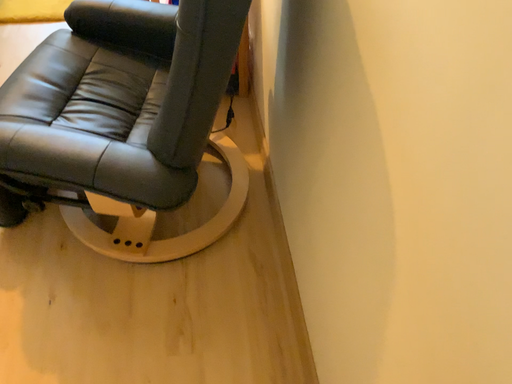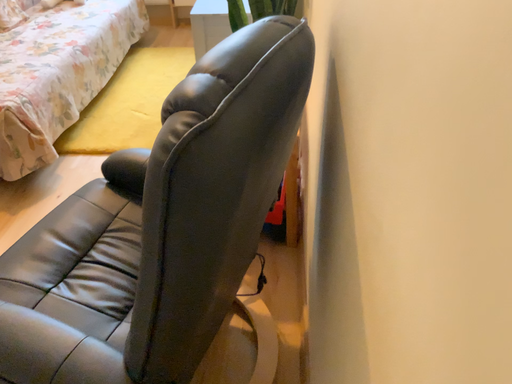
Question: Which way did the camera rotate in the video?

Choices:
 (A) rotated left
 (B) rotated right

Answer: (A)